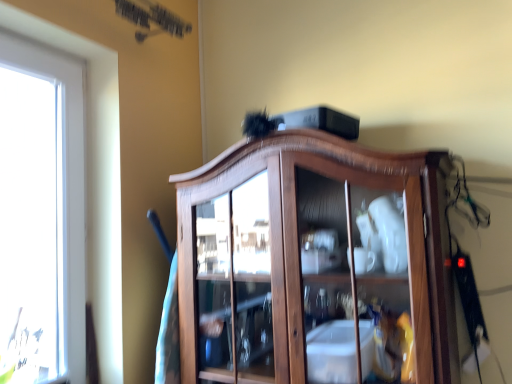
Question: Should I look upward or downward to see wooden cabinet at center?

Choices:
 (A) up
 (B) down

Answer: (B)